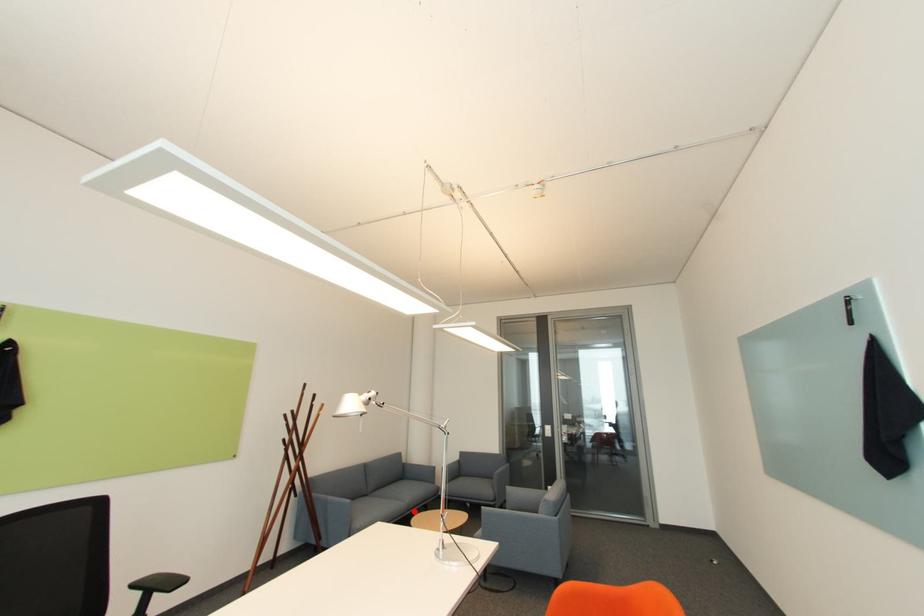
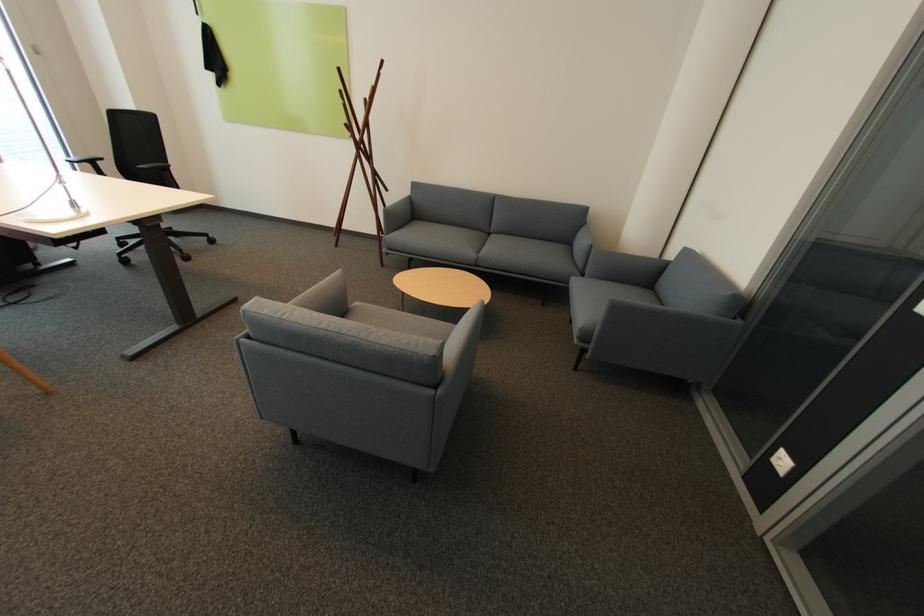
Question: I am providing you with two images of the same scene from different viewpoints. A red point is marked on the first image. At the location where the point appears in image 1, is it still visible in image 2?

Choices:
 (A) Yes
 (B) No

Answer: (A)